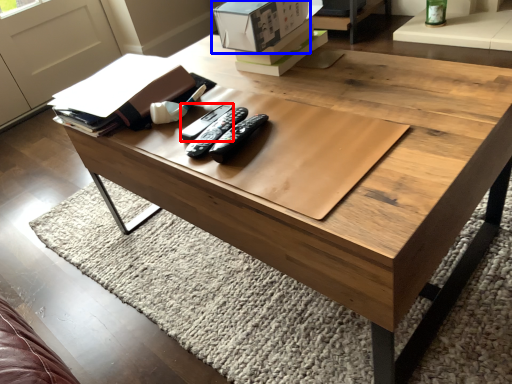
Question: Which of the following is the farthest to the observer, remote (highlighted by a red box) or cardboard box (highlighted by a blue box)?

Choices:
 (A) remote
 (B) cardboard box

Answer: (B)